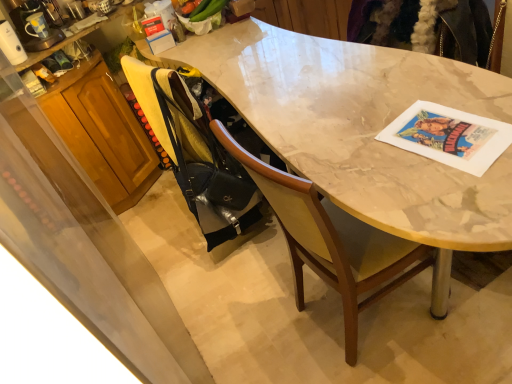
Question: Is black matte handbag at lower left wider or thinner than wooden cabinet at left?

Choices:
 (A) wide
 (B) thin

Answer: (A)

Question: Considering the positions of point (254, 195) and point (118, 196), is point (254, 195) closer or farther from the camera than point (118, 196)?

Choices:
 (A) closer
 (B) farther

Answer: (A)

Question: Estimate the real-world distances between objects in this image. Which object is closer to the wooden cabinet at left?

Choices:
 (A) marble table at center
 (B) black matte handbag at lower left
 (C) white glossy coffee maker at upper left

Answer: (C)

Question: Which of these objects is positioned farthest from the white glossy coffee maker at upper left?

Choices:
 (A) marble table at center
 (B) black matte handbag at lower left
 (C) wooden cabinet at left

Answer: (A)